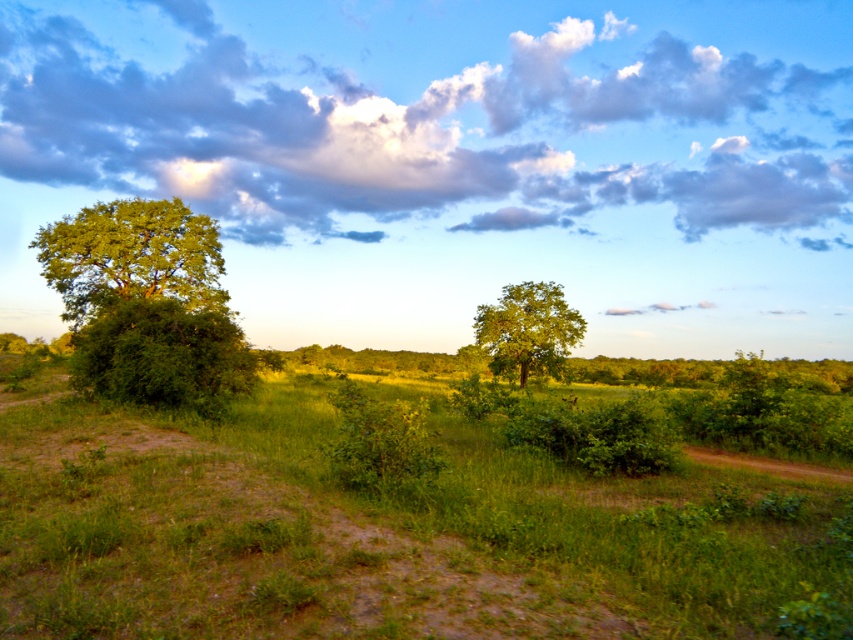
Question: Is green grass at center wider than green leafy tree at left?

Choices:
 (A) no
 (B) yes

Answer: (A)

Question: Which point appears closest to the camera in this image?

Choices:
 (A) (672, 92)
 (B) (531, 307)
 (C) (57, 260)

Answer: (B)

Question: Estimate the real-world distances between objects in this image. Which object is farther from the green leafy tree at center?

Choices:
 (A) cloudy sky at upper center
 (B) green grass at center
 (C) green leafy tree at left

Answer: (A)

Question: Is green grass at center behind green leafy tree at center?

Choices:
 (A) yes
 (B) no

Answer: (B)

Question: Considering the relative positions of green grass at center and green leafy tree at left in the image provided, where is green grass at center located with respect to green leafy tree at left?

Choices:
 (A) below
 (B) above

Answer: (A)

Question: Considering the real-world distances, which object is closest to the green leafy tree at left?

Choices:
 (A) cloudy sky at upper center
 (B) green leafy tree at center

Answer: (B)